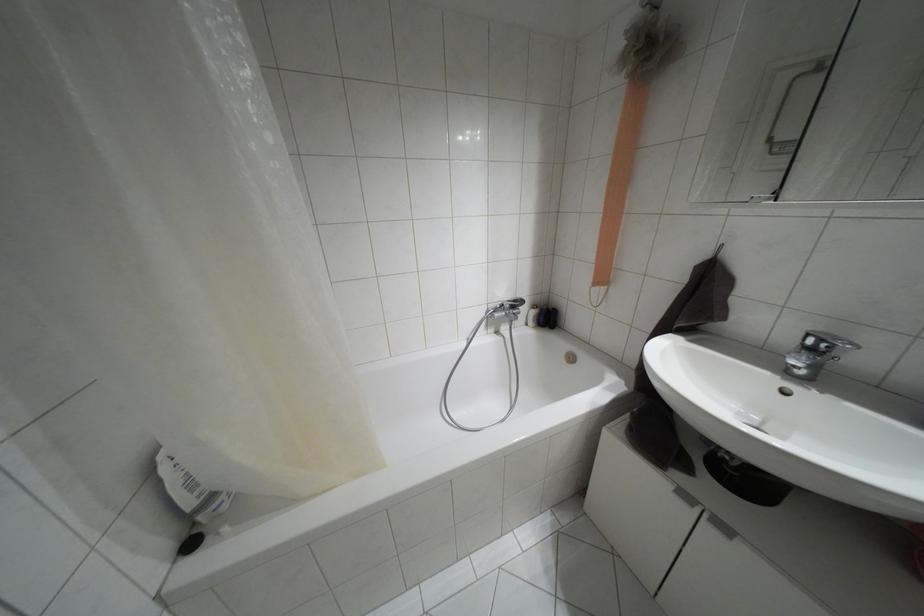
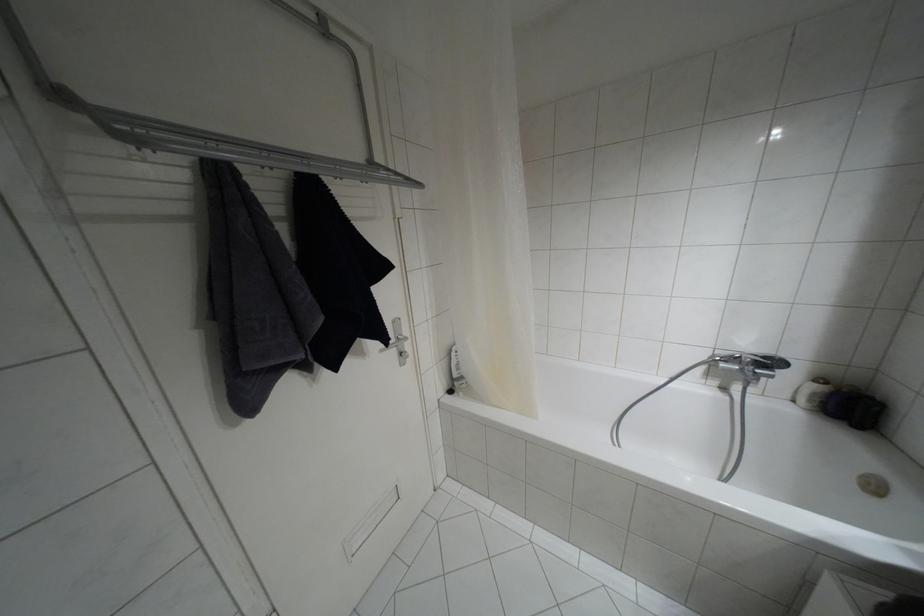
Locate, in the second image, the point that corresponds to (x=532, y=306) in the first image.

(820, 379)